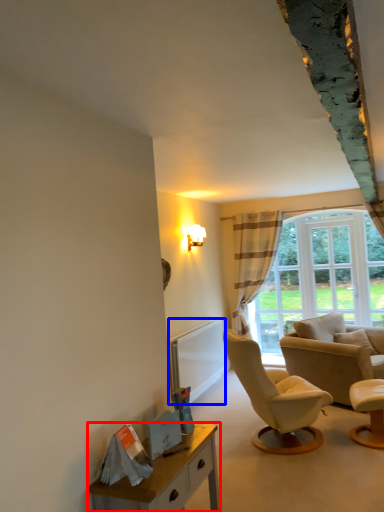
Question: Among these objects, which one is nearest to the camera, desk (highlighted by a red box) or radiator (highlighted by a blue box)?

Choices:
 (A) desk
 (B) radiator

Answer: (A)